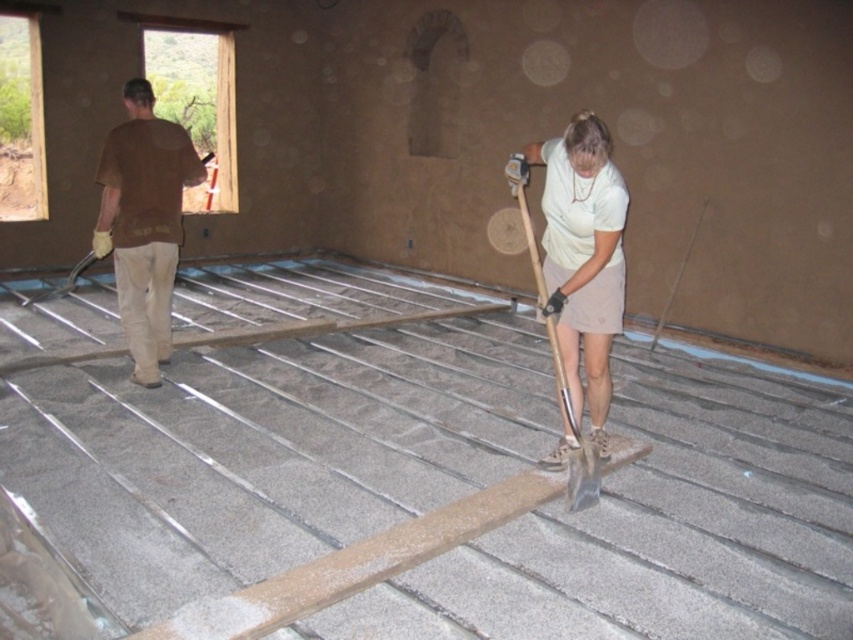
You are a construction worker observing the scene. There is a brown cotton shirt at left and a metallic silver shovel at center. Which object is positioned higher relative to the other?

The brown cotton shirt at left is located above the metallic silver shovel at center.

You are a construction worker who needs to locate your tools. You see a brown cotton shirt at left and a metallic silver shovel at center. Which object is positioned more to the left?

The brown cotton shirt at left is positioned more to the left than the metallic silver shovel at center.